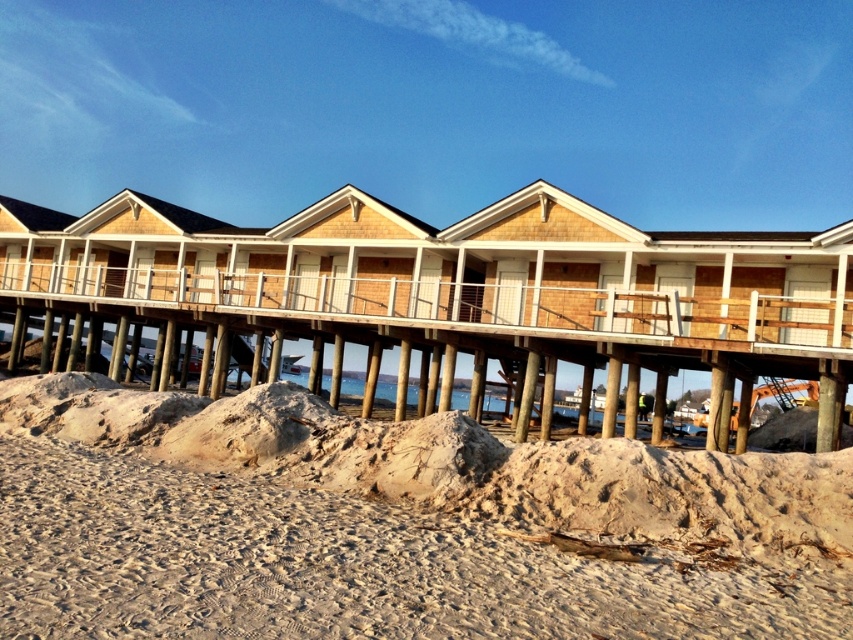
You are standing on the beach looking at the houses. Which object is nearer to you, the fine sand at lower center or the wooden dock at center?

The fine sand at lower center is closer to the viewer than the wooden dock at center.

You are a construction worker assessing the beachfront area. You need to determine which material is more suitable for building a temporary base for equipment. The fine sand at lower center and the wooden dock at center are both available. Which one would you choose and why?

The wooden dock at center is more suitable for building a temporary base because the fine sand at lower center has a smaller size and cannot provide stable support, whereas the wooden dock is larger and sturdier.